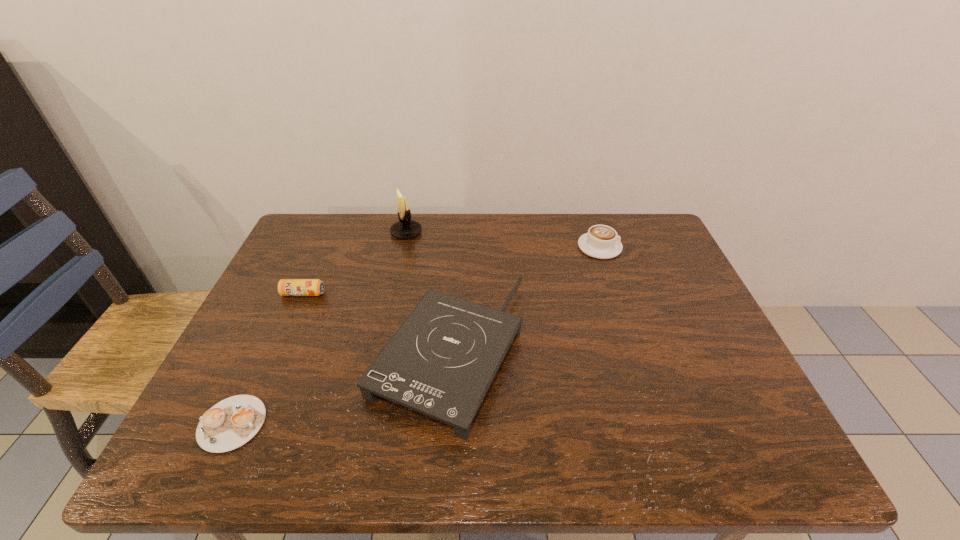
You are a GUI agent. You are given a task and a screenshot of the screen. Output one action in this format:
    pyautogui.click(x=<x>, y=<y>)
    Task: Click on the vacant space at the far edge of the desktop
    
    Given the screenshot: What is the action you would take?
    pyautogui.click(x=445, y=214)

In the image, there is a desktop. At what (x,y) coordinates should I click in order to perform the action: click on blank space at the near edge. Please return your answer as a coordinate pair (x, y). Looking at the image, I should click on (381, 455).

This screenshot has width=960, height=540. I want to click on vacant space at the left edge of the desktop, so click(255, 379).

The width and height of the screenshot is (960, 540). Identify the location of blank area at the right edge. (676, 306).

This screenshot has height=540, width=960. Identify the location of free space at the near left corner. (244, 448).

In the image, there is a desktop. Where is `vacant space at the far right corner`? vacant space at the far right corner is located at coordinates (615, 224).

Where is `free location at the near right corner of the desktop`? The width and height of the screenshot is (960, 540). free location at the near right corner of the desktop is located at coordinates (758, 461).

Where is `free spot between the tallest object and the right cappuccino`? This screenshot has height=540, width=960. free spot between the tallest object and the right cappuccino is located at coordinates (503, 240).

The width and height of the screenshot is (960, 540). I want to click on unoccupied position between the candle holder and the second shortest object, so click(x=354, y=263).

You are a GUI agent. You are given a task and a screenshot of the screen. Output one action in this format:
    pyautogui.click(x=<x>, y=<y>)
    Task: Click on the free space between the second shortest object and the left cappuccino
    The image size is (960, 540).
    Given the screenshot: What is the action you would take?
    pyautogui.click(x=268, y=359)